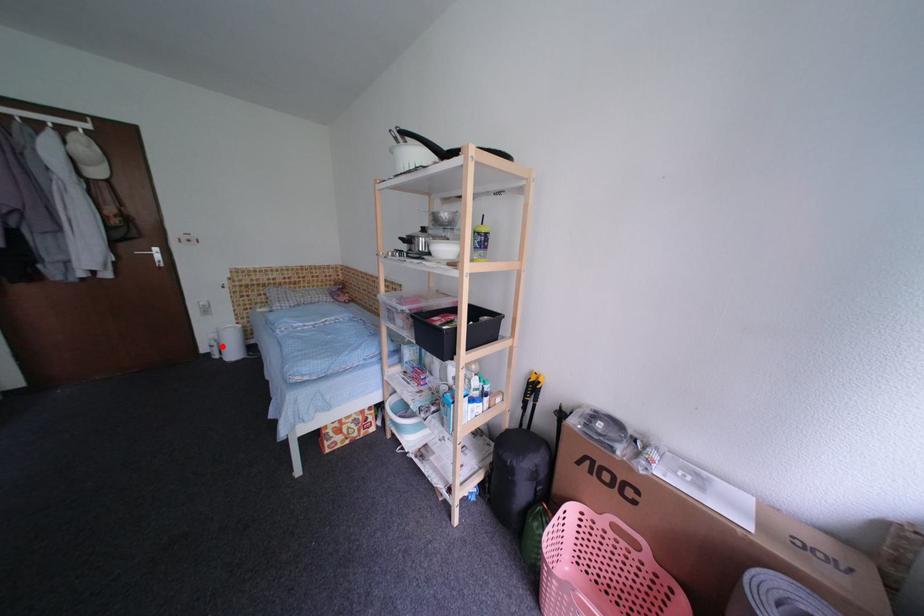
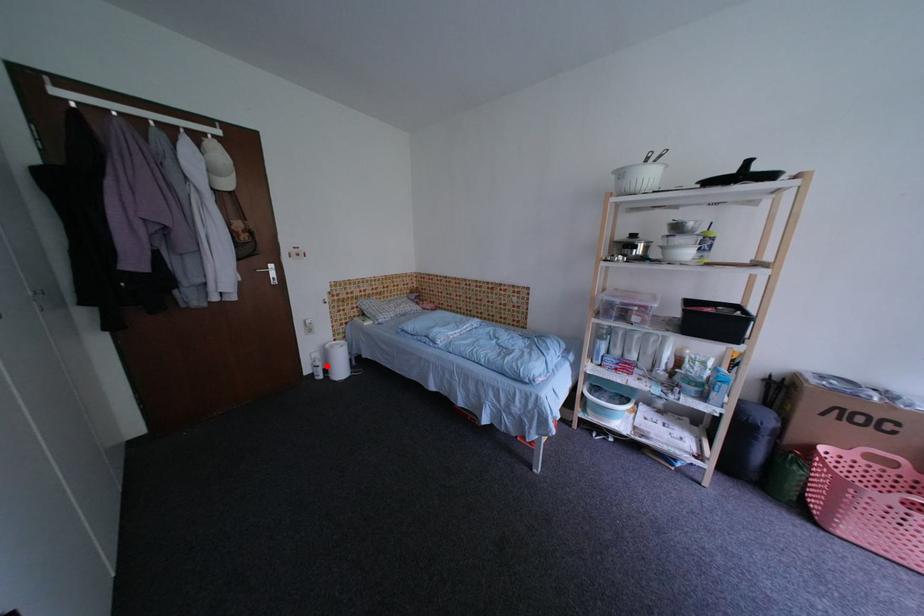
I am providing you with two images of the same scene from different viewpoints. A red point is marked on the first image and another point is marked on the second image. Do the highlighted points in image1 and image2 indicate the same real-world spot?

Yes